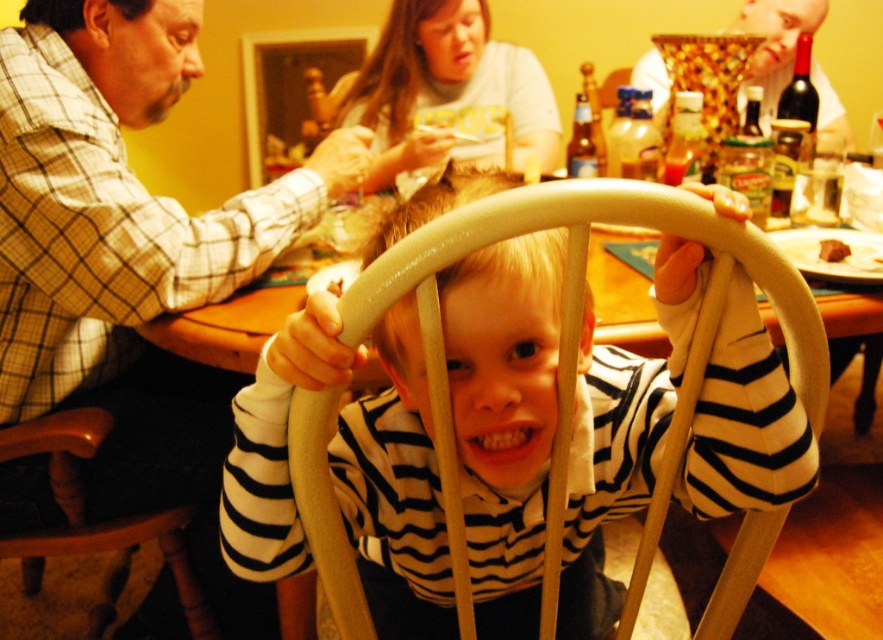
Question: Which is farther from the smooth gold bowl at upper right?

Choices:
 (A) white striped shirt at center
 (B) plaid shirt at left
 (C) white cotton shirt at upper center
 (D) wooden chair at lower left

Answer: (D)

Question: Does plaid shirt at left appear under smooth gold bowl at upper right?

Choices:
 (A) no
 (B) yes

Answer: (B)

Question: Is white striped shirt at center positioned behind brown crumbly bread at center?

Choices:
 (A) yes
 (B) no

Answer: (B)

Question: Among these points, which one is nearest to the camera?

Choices:
 (A) (778, 68)
 (B) (74, 516)
 (C) (180, 273)
 (D) (474, 561)

Answer: (D)

Question: Which object is farther from the camera taking this photo?

Choices:
 (A) brown crumbly bread at center
 (B) wooden chair at lower left
 (C) plaid shirt at left

Answer: (A)

Question: Does plaid shirt at left lie in front of brown crumbly bread at center?

Choices:
 (A) no
 (B) yes

Answer: (B)